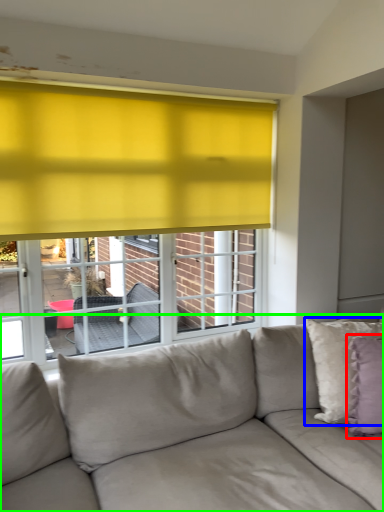
Question: Which is nearer to the pillow (highlighted by a red box)? pillow (highlighted by a blue box) or studio couch (highlighted by a green box).

Choices:
 (A) pillow
 (B) studio couch

Answer: (A)